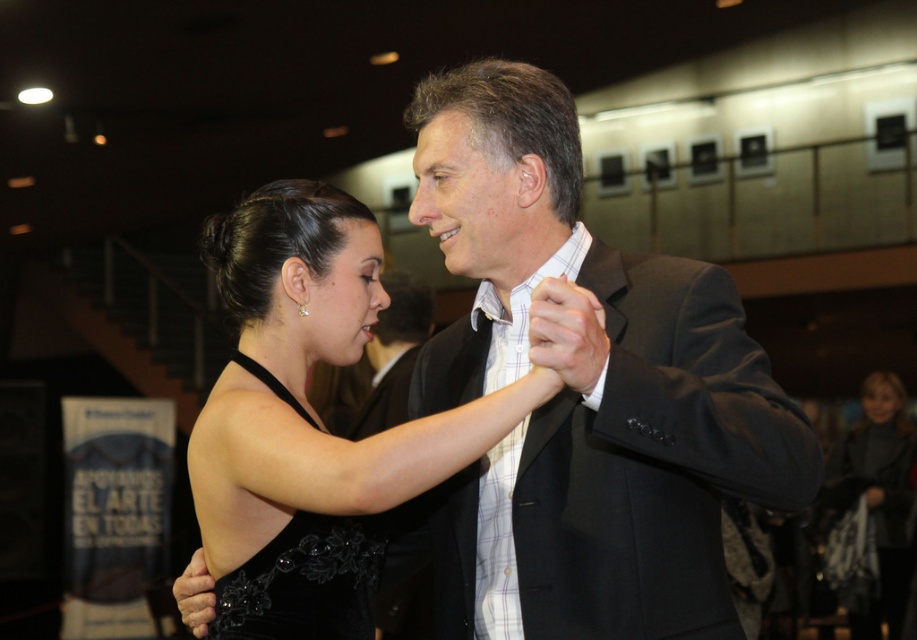
Between point (461, 492) and point (482, 632), which one is positioned behind?

Point (461, 492)

Can you confirm if black satin dress at center is smaller than white checkered dress shirt at center?

No, black satin dress at center is not smaller than white checkered dress shirt at center.

The image size is (917, 640). What do you see at coordinates (583, 388) in the screenshot? I see `black satin dress at center` at bounding box center [583, 388].

Identify the location of black satin dress at center. (583, 388).

Is white checkered dress shirt at center shorter than black velvet dress at lower right?

Indeed, white checkered dress shirt at center has a lesser height compared to black velvet dress at lower right.

Is white checkered dress shirt at center above black velvet dress at lower right?

Correct, white checkered dress shirt at center is located above black velvet dress at lower right.

Is point (509, 564) behind point (860, 465)?

No, it is not.

Where is `white checkered dress shirt at center`? The image size is (917, 640). white checkered dress shirt at center is located at coordinates (496, 541).

Measure the distance between black satin dress at center and camera.

black satin dress at center and camera are 5.71 feet apart from each other.

Does point (440, 588) come farther from viewer compared to point (892, 436)?

No, (440, 588) is closer to viewer.

Between point (564, 452) and point (897, 531), which one is positioned behind?

Positioned behind is point (897, 531).

Where is `black satin dress at center`? The height and width of the screenshot is (640, 917). black satin dress at center is located at coordinates (583, 388).